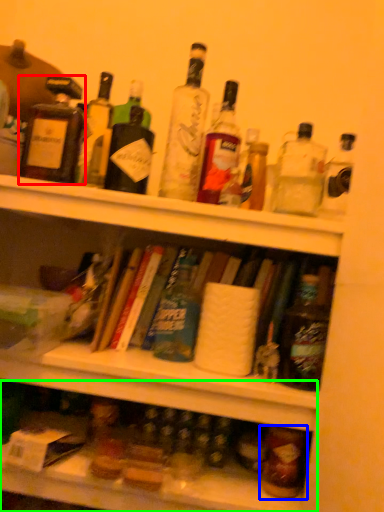
Question: Considering the real-world distances, which object is farthest from bottle (highlighted by a red box)? bottle (highlighted by a blue box) or shelf (highlighted by a green box)?

Choices:
 (A) bottle
 (B) shelf

Answer: (A)